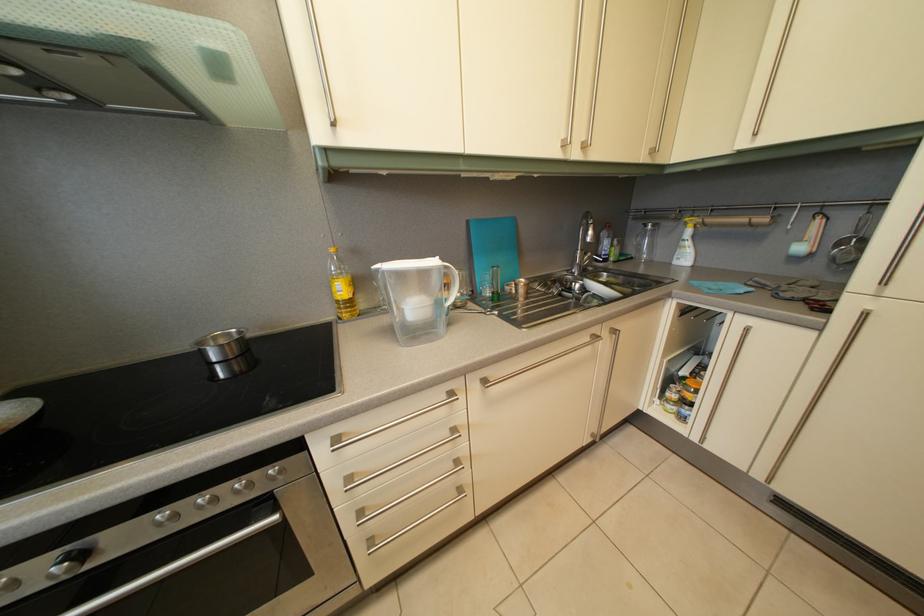
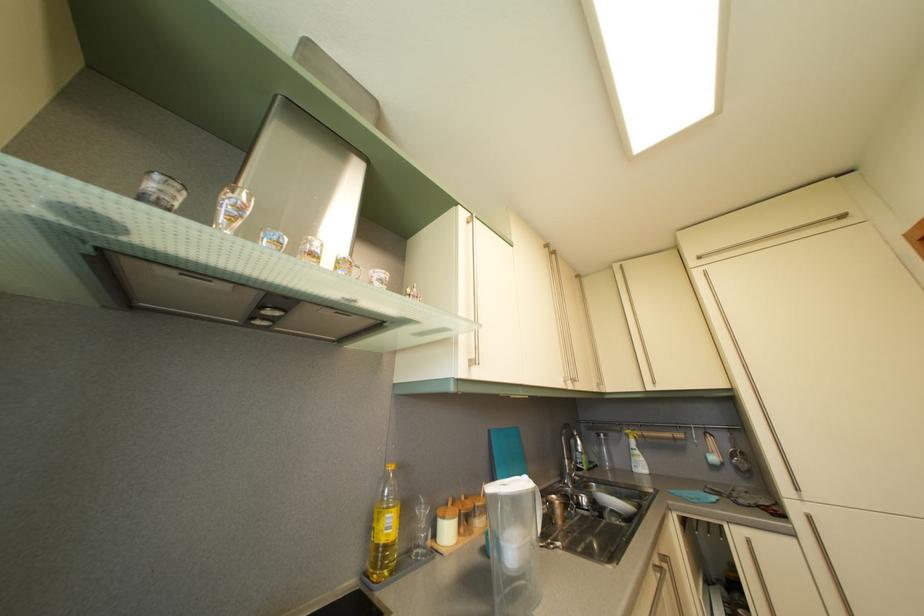
In the second image, find the point that corresponds to (594,221) in the first image.

(575, 432)